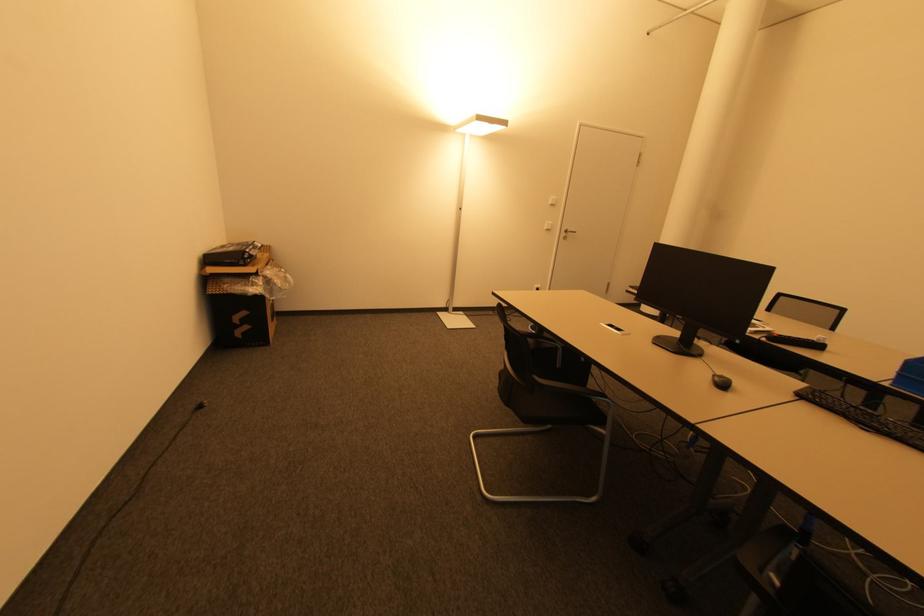
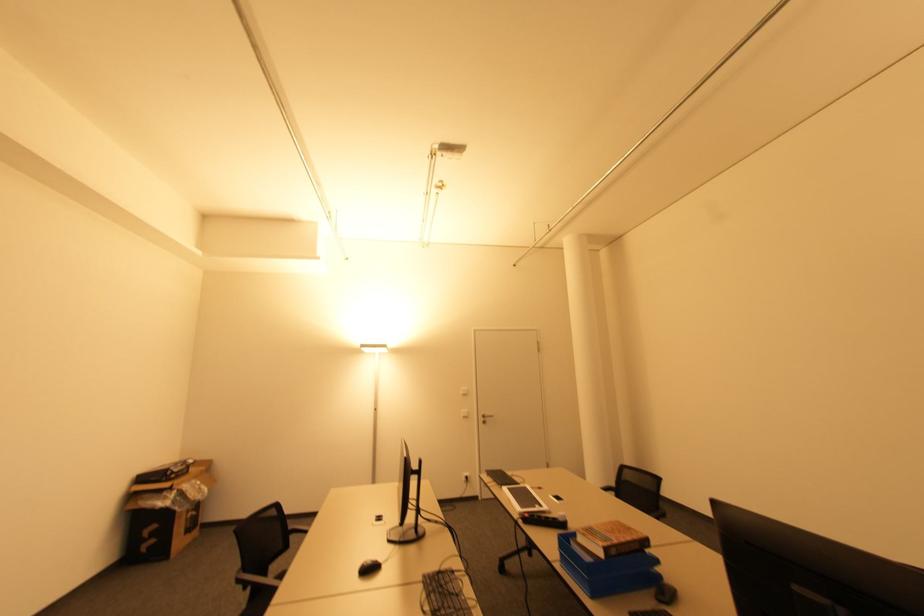
The point at (550,230) is marked in the first image. Where is the corresponding point in the second image?

(467, 416)